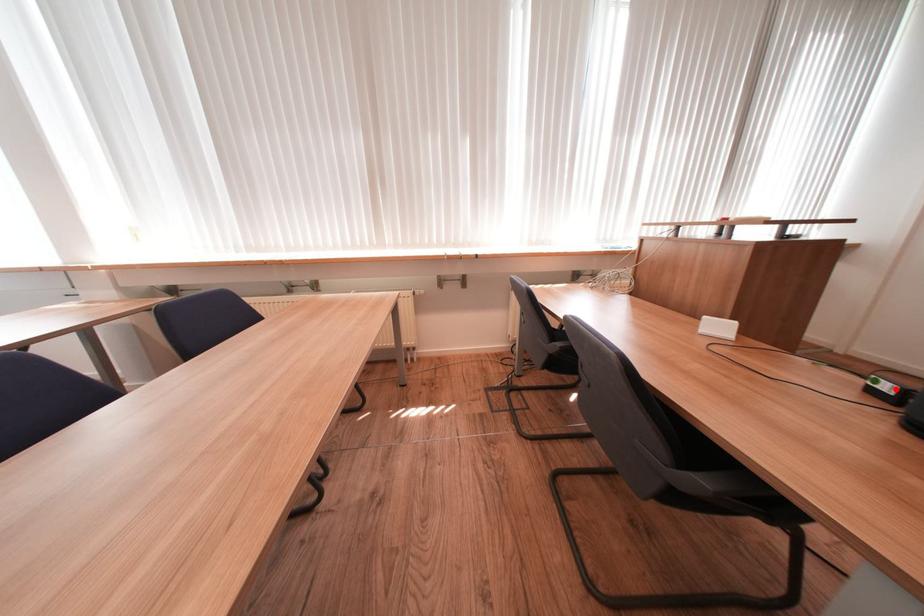
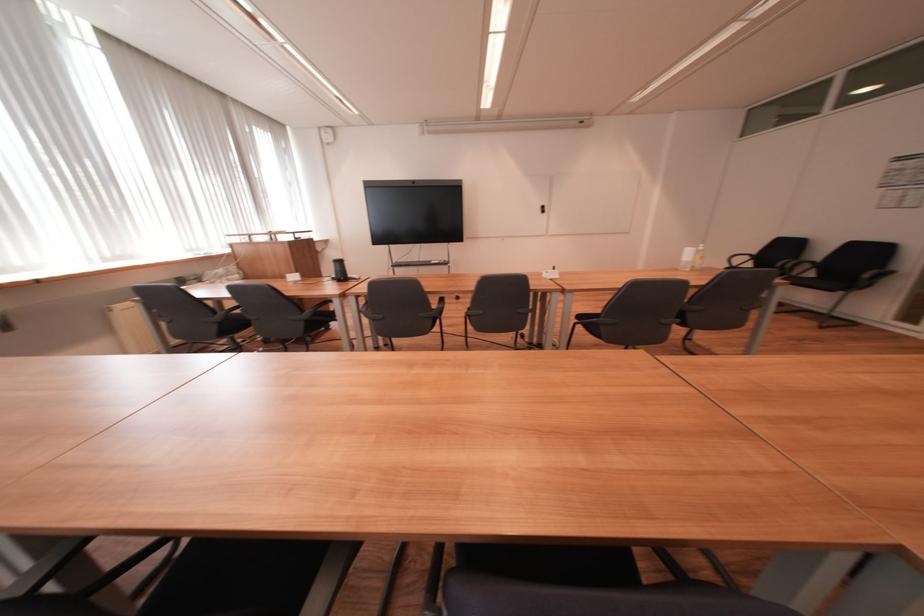
Question: I am providing you with two images of the same scene from different viewpoints. Image1 has a red point marked. In image2, the corresponding 3D location appears at what relative position? Reply with the corresponding letter.

Choices:
 (A) Closer
 (B) Farther

Answer: (B)